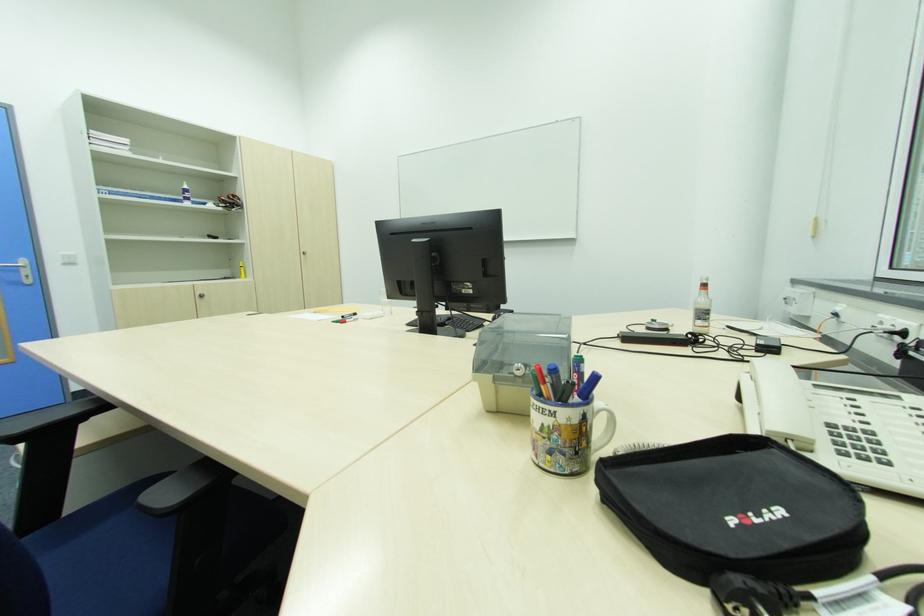
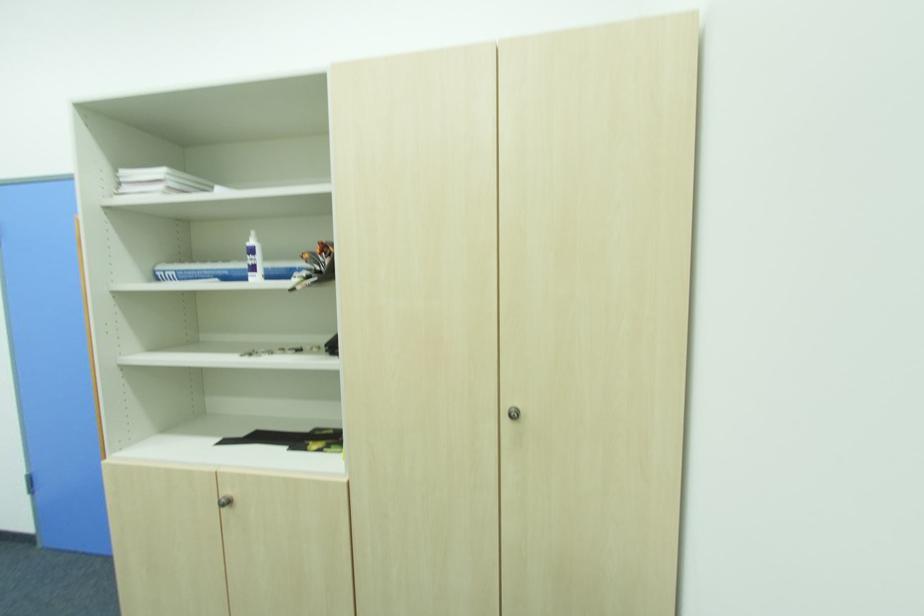
In the second image, find the point that corresponds to [307,254] in the first image.

(513, 416)